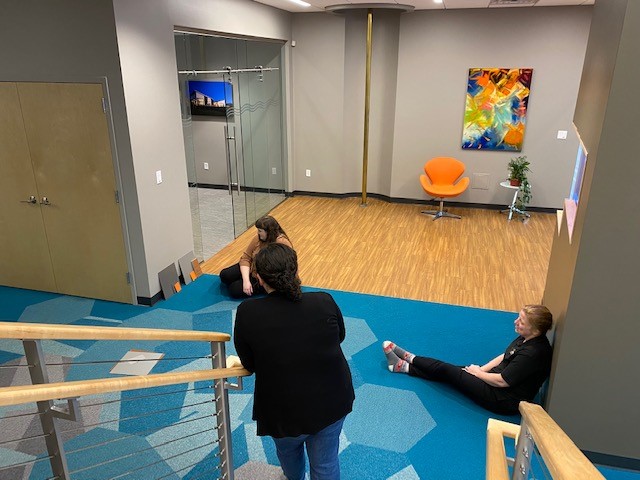
Identify the location of stair handles. The image size is (640, 480). (66, 334), (66, 394), (559, 432), (495, 446).